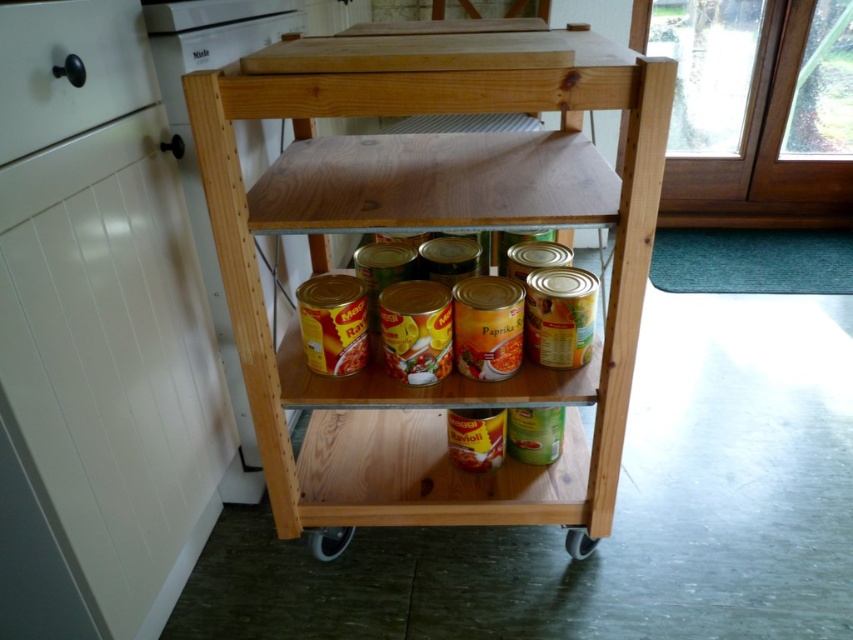
Between natural wood shelf at center and black rubber wheel at lower center, which one appears on the right side from the viewer's perspective?

natural wood shelf at center

From the picture: Does natural wood shelf at center have a smaller size compared to black rubber wheel at lower center?

Incorrect, natural wood shelf at center is not smaller in size than black rubber wheel at lower center.

Who is more forward, (x=427, y=513) or (x=322, y=552)?

Positioned in front is point (x=427, y=513).

Where is `natural wood shelf at center`? natural wood shelf at center is located at coordinates (431, 227).

Between black rubber wheel at lower center and gray rubber wheel at lower center, which one is positioned lower?

black rubber wheel at lower center is below.

The height and width of the screenshot is (640, 853). I want to click on black rubber wheel at lower center, so 329,541.

The width and height of the screenshot is (853, 640). I want to click on black rubber wheel at lower center, so click(329, 541).

Who is shorter, natural wood shelf at center or gray rubber wheel at lower center?

gray rubber wheel at lower center

Who is more forward, [346,140] or [573,540]?

Point [573,540] is more forward.

Locate an element on the screen. The height and width of the screenshot is (640, 853). natural wood shelf at center is located at coordinates (431, 227).